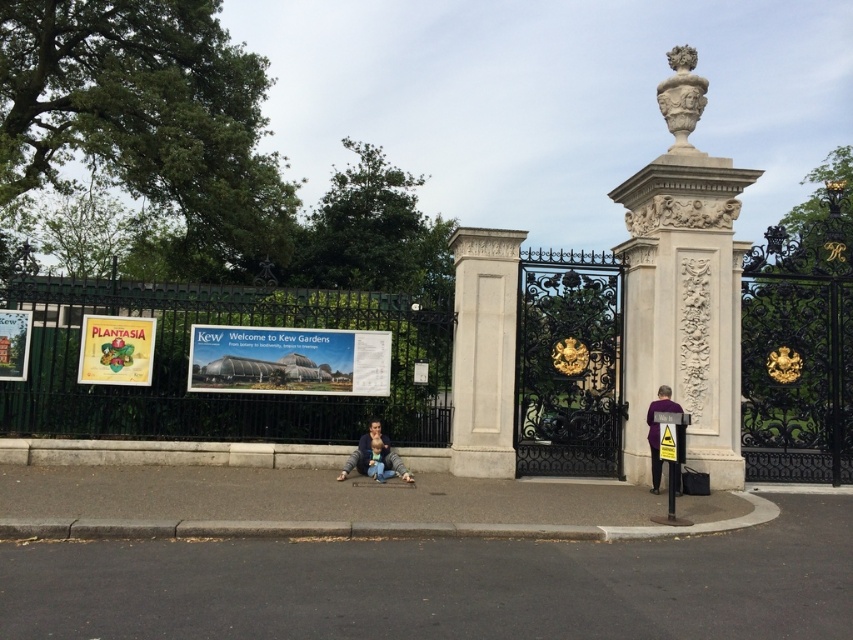
You are standing at the entrance of Kew Gardens and see two points marked on the ground. The first point is at coordinates point (675, 54) and the second point is at point (381, 435). Which point is closer to you?

Point (675, 54) is further to the viewer than point (381, 435), so the second point is closer to you.

You are planning to hang a banner between the green wrought iron fence at center and the white stone column at center for an event. Which object should the banner be attached to if you want it to reach the highest point?

The green wrought iron fence at center is much taller than the white stone column at center, so the banner should be attached to the green wrought iron fence at center to reach the highest point.